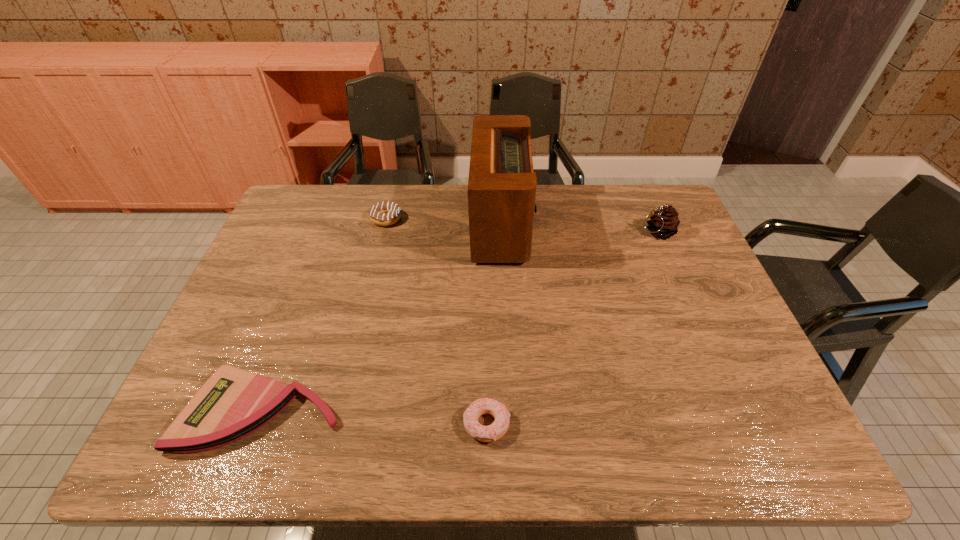
The image size is (960, 540). In order to click on the tallest object in this screenshot , I will do `click(502, 185)`.

Find the location of a particular element. the rightmost object is located at coordinates (664, 223).

Identify the location of pinecone. The height and width of the screenshot is (540, 960). (664, 223).

Where is `the farther doughnut`? Image resolution: width=960 pixels, height=540 pixels. the farther doughnut is located at coordinates (385, 213).

At what (x,y) coordinates should I click in order to perform the action: click on the nearer doughnut. Please return your answer as a coordinate pair (x, y). The image size is (960, 540). Looking at the image, I should click on (499, 427).

This screenshot has height=540, width=960. What are the coordinates of `wristlet` in the screenshot? It's located at (233, 403).

Find the location of `blank space located on the left of the tallest object`. blank space located on the left of the tallest object is located at coordinates (449, 223).

The width and height of the screenshot is (960, 540). Find the location of `vacant space situated 0.120m with a leaf charm attached to the rightmost object`. vacant space situated 0.120m with a leaf charm attached to the rightmost object is located at coordinates (601, 232).

In order to click on vacant space situated 0.180m with a leaf charm attached to the rightmost object in this screenshot , I will do `click(582, 232)`.

Identify the location of vacant space located 0.090m with a leaf charm attached to the rightmost object. This screenshot has width=960, height=540. (610, 232).